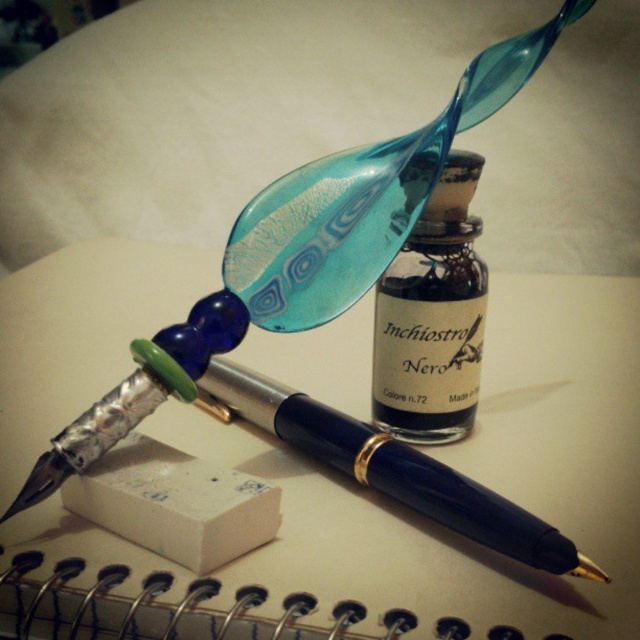
Does spiral-bound paper at center have a lesser height compared to white paper at center?

No.

Is the position of spiral-bound paper at center more distant than that of white paper at center?

No, spiral-bound paper at center is in front of white paper at center.

The height and width of the screenshot is (640, 640). I want to click on spiral-bound paper at center, so click(472, 477).

Is spiral-bound paper at center positioned behind translucent glass ink bottle at center?

No, it is in front of translucent glass ink bottle at center.

Who is taller, spiral-bound paper at center or translucent glass ink bottle at center?

spiral-bound paper at center is taller.

You are a GUI agent. You are given a task and a screenshot of the screen. Output one action in this format:
    pyautogui.click(x=<x>, y=<y>)
    Task: Click on the spiral-bound paper at center
    The width and height of the screenshot is (640, 640).
    Given the screenshot: What is the action you would take?
    pyautogui.click(x=472, y=477)

The width and height of the screenshot is (640, 640). What are the coordinates of `spiral-bound paper at center` in the screenshot? It's located at (472, 477).

The width and height of the screenshot is (640, 640). In order to click on translucent glass ink bottle at center in this screenshot , I will do `click(433, 317)`.

Does translucent glass ink bottle at center have a greater height compared to white paper at center?

Yes, translucent glass ink bottle at center is taller than white paper at center.

Is point (419, 384) positioned in front of point (200, 520)?

No, (419, 384) is behind (200, 520).

The image size is (640, 640). In order to click on translucent glass ink bottle at center in this screenshot , I will do `click(433, 317)`.